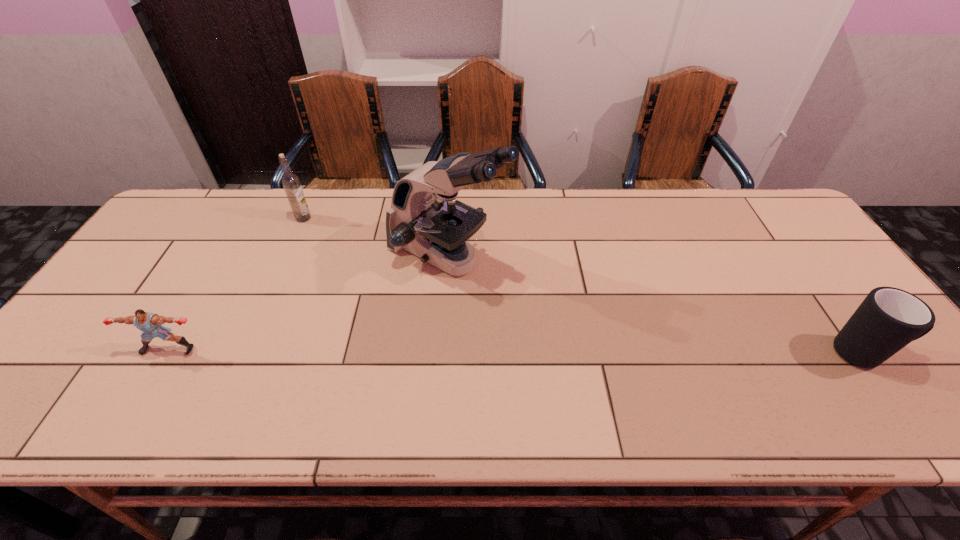
Locate an element on the screen. puncher is located at coordinates (150, 324).

What are the coordinates of `the leftmost object` in the screenshot? It's located at (150, 324).

Image resolution: width=960 pixels, height=540 pixels. What are the coordinates of `the third tallest object` in the screenshot? It's located at (888, 319).

Identify the location of mug. This screenshot has height=540, width=960. (888, 319).

Identify the location of microscope. (425, 218).

Locate an element on the screen. Image resolution: width=960 pixels, height=540 pixels. the second farthest object is located at coordinates (425, 218).

This screenshot has height=540, width=960. Identify the location of the third shortest object. (290, 181).

You are a GUI agent. You are given a task and a screenshot of the screen. Output one action in this format:
    pyautogui.click(x=<x>, y=<y>)
    Task: Click on the farthest object
    
    Given the screenshot: What is the action you would take?
    pyautogui.click(x=290, y=181)

Where is `free point located 0.060m on the front-facing side of the leftmost object`? This screenshot has width=960, height=540. free point located 0.060m on the front-facing side of the leftmost object is located at coordinates (152, 379).

I want to click on blank space located through the eyepieces of the tallest object, so 556,313.